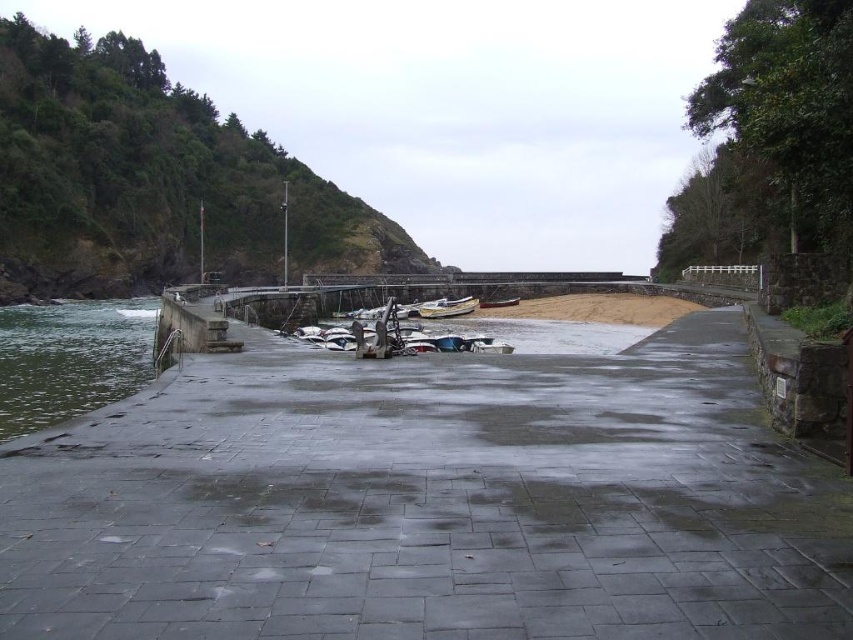
You are standing on the paved walkway and want to take a photo of both the green smooth water at lower left and the white matte boat at center. Which object should you focus on first to ensure both are in clear view?

You should focus on the green smooth water at lower left first because it is closer to you than the white matte boat at center, ensuring both are in clear view.

You are standing on the paved walkway in the foreground of the scene. You want to walk to the white matte boat at center. Which direction should you head towards?

The white matte boat at center is located at point [447,307], so you should head towards the center of the scene to reach it.